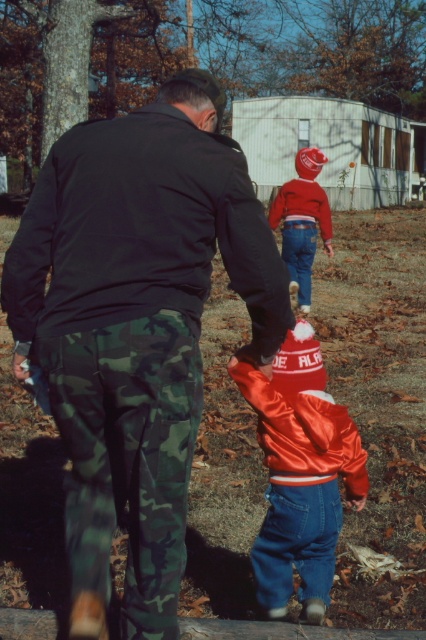
You are a parent trying to choose between two jackets for your child from the image. The shiny orange jacket at lower right and the shiny red jacket at center are both options. Based on their sizes, which jacket would be more appropriate for a child?

The shiny orange jacket at lower right is smaller in size compared to the shiny red jacket at center, making it more appropriate for a child.

You are a photographer trying to capture the shiny red jacket at center and the shiny red jacket at upper center in the same frame. Which jacket should you focus on first if you want to ensure both are clearly visible in your photo?

The shiny red jacket at center has a larger size compared to the shiny red jacket at upper center, so focusing on the larger jacket first will help ensure both are clearly visible in the photo.